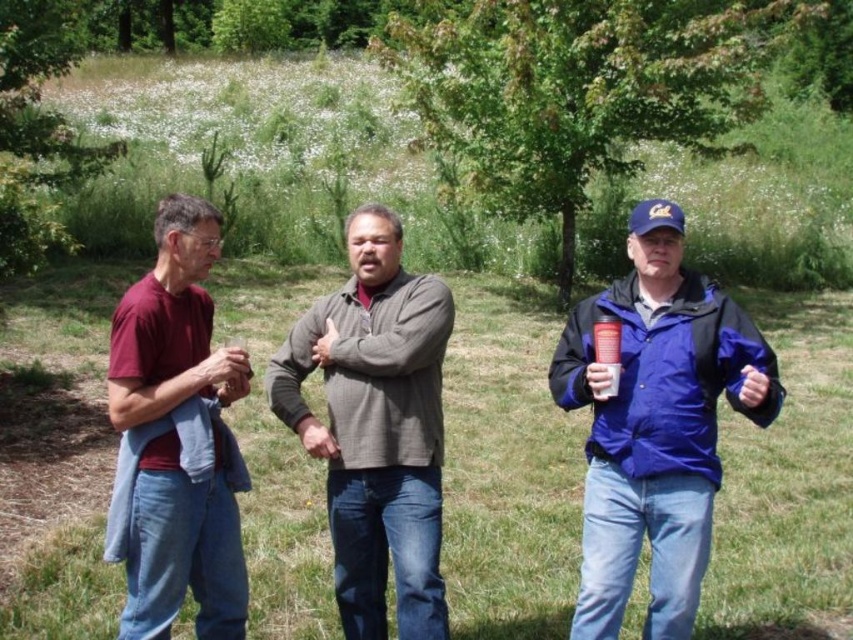
Is point (221, 598) farther from viewer compared to point (612, 364)?

Yes, it is behind point (612, 364).

Does point (225, 368) come behind point (607, 394)?

Yes, it is behind point (607, 394).

Locate an element on the screen. The height and width of the screenshot is (640, 853). maroon fabric shirt at left is located at coordinates (171, 324).

How much distance is there between gray sweater at center and maroon fabric shirt at left?

A distance of 24.74 inches exists between gray sweater at center and maroon fabric shirt at left.

Which of these two, gray sweater at center or maroon fabric shirt at left, stands taller?

gray sweater at center

I want to click on gray sweater at center, so click(x=375, y=428).

Is blue matte jacket at right bigger than gray sweater at center?

Indeed, blue matte jacket at right has a larger size compared to gray sweater at center.

Is blue matte jacket at right above gray sweater at center?

Incorrect, blue matte jacket at right is not positioned above gray sweater at center.

Which is in front, point (614, 577) or point (289, 404)?

Point (614, 577) is more forward.

The height and width of the screenshot is (640, 853). Identify the location of blue matte jacket at right. (656, 424).